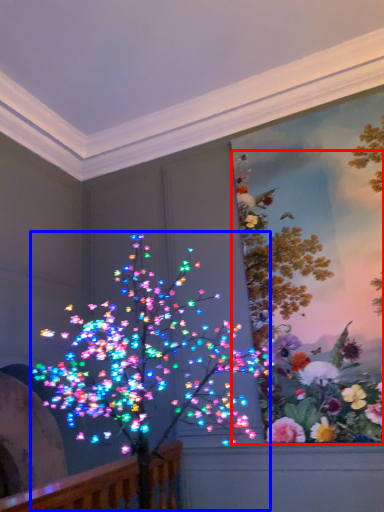
Question: Which object appears farthest to the camera in this image, floral arrangement (highlighted by a red box) or christmas decoration (highlighted by a blue box)?

Choices:
 (A) floral arrangement
 (B) christmas decoration

Answer: (A)